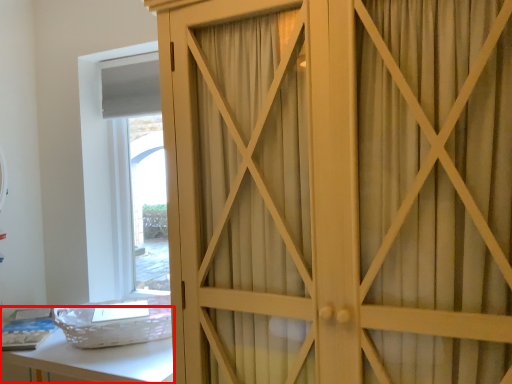
Question: From the image's perspective, where is vanity (annotated by the red box) located in relation to cupboard in the image?

Choices:
 (A) below
 (B) above

Answer: (A)